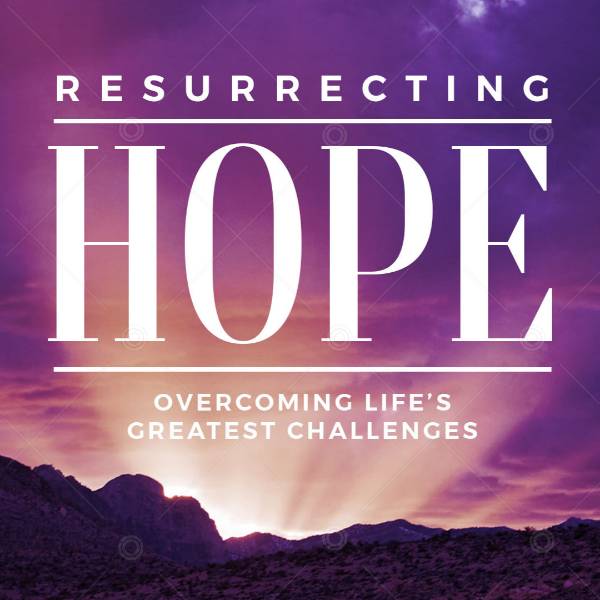
The height and width of the screenshot is (600, 600). Find the location of `book`. book is located at coordinates (248, 432).